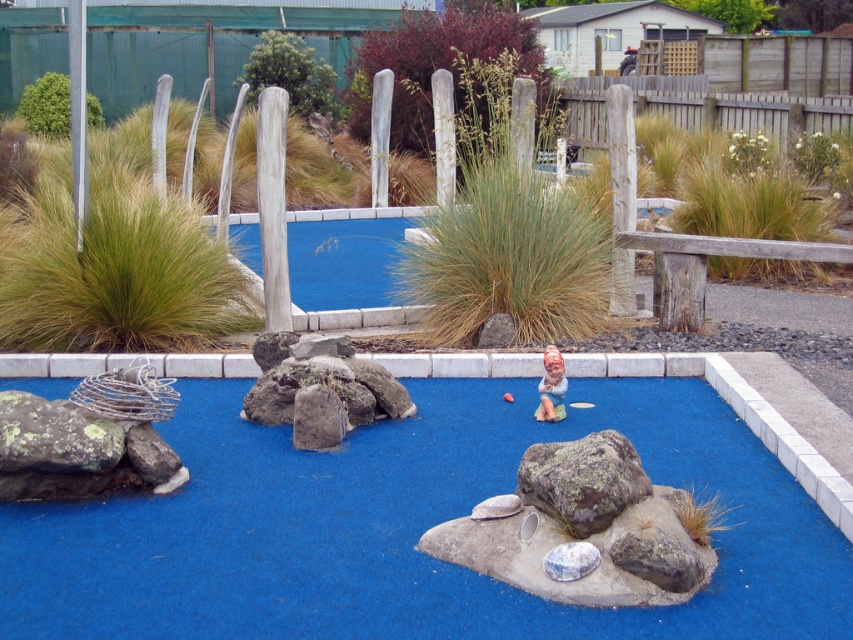
Can you confirm if green mossy rock at center is smaller than lichen-covered rock at left?

No, green mossy rock at center is not smaller than lichen-covered rock at left.

Does point (619, 476) come behind point (41, 404)?

No, (619, 476) is closer to viewer.

Locate an element on the screen. green mossy rock at center is located at coordinates (582, 480).

Which of these two, lichen-covered rock at left or matte ceramic figurine at center, stands shorter?

lichen-covered rock at left

Who is more distant from viewer, (91, 456) or (548, 388)?

Positioned behind is point (548, 388).

Where is `lichen-covered rock at left`? The height and width of the screenshot is (640, 853). lichen-covered rock at left is located at coordinates (54, 436).

Can you confirm if blue rubber golf course at center is wider than brown rough rock at center?

Yes.

Is point (844, 609) positioned behind point (305, 420)?

No, it is not.

Locate an element on the screen. This screenshot has width=853, height=640. blue rubber golf course at center is located at coordinates (408, 528).